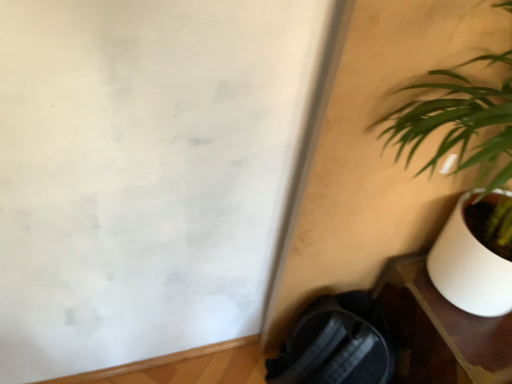
The image size is (512, 384). Describe the element at coordinates (457, 172) in the screenshot. I see `green leafy plant at right` at that location.

Locate an element on the screen. The image size is (512, 384). green leafy plant at right is located at coordinates (457, 172).

This screenshot has width=512, height=384. What do you see at coordinates (439, 330) in the screenshot?
I see `white glossy table at lower right` at bounding box center [439, 330].

Find the location of a particular element. The height and width of the screenshot is (384, 512). white glossy table at lower right is located at coordinates (439, 330).

What is the approximate width of white glossy table at lower right?

white glossy table at lower right is 15.37 inches wide.

I want to click on green leafy plant at right, so click(457, 172).

Does green leafy plant at right appear on the right side of white glossy table at lower right?

In fact, green leafy plant at right is to the left of white glossy table at lower right.

Considering the positions of objects green leafy plant at right and white glossy table at lower right in the image provided, who is behind, green leafy plant at right or white glossy table at lower right?

white glossy table at lower right is further away from the camera.

Is point (505, 181) in front of point (416, 373)?

Yes, it is.

From the image's perspective, is green leafy plant at right positioned above or below white glossy table at lower right?

green leafy plant at right is above white glossy table at lower right.

From a real-world perspective, which is physically above, green leafy plant at right or white glossy table at lower right?

green leafy plant at right.

Which of these two, green leafy plant at right or white glossy table at lower right, is thinner?

green leafy plant at right.

Who is shorter, green leafy plant at right or white glossy table at lower right?

white glossy table at lower right is shorter.

Is green leafy plant at right bigger or smaller than white glossy table at lower right?

In the image, green leafy plant at right appears to be smaller than white glossy table at lower right.

Is green leafy plant at right outside of white glossy table at lower right?

green leafy plant at right lies outside white glossy table at lower right's area.

Are green leafy plant at right and white glossy table at lower right far apart?

No, green leafy plant at right is not far from white glossy table at lower right.

Does green leafy plant at right turn towards white glossy table at lower right?

Yes, green leafy plant at right faces towards white glossy table at lower right.

The width and height of the screenshot is (512, 384). What are the coordinates of `houseplant that is above the white glossy table at lower right (from a real-world perspective)` in the screenshot? It's located at (457, 172).

Which is more to the right, white glossy table at lower right or green leafy plant at right?

From the viewer's perspective, white glossy table at lower right appears more on the right side.

Considering the relative positions of white glossy table at lower right and green leafy plant at right in the image provided, is white glossy table at lower right in front of green leafy plant at right?

No, it is behind green leafy plant at right.

Which point is more forward, (412, 285) or (484, 158)?

The point (484, 158) is more forward.

From the image's perspective, is white glossy table at lower right below green leafy plant at right?

Yes.

From a real-world perspective, does white glossy table at lower right stand above green leafy plant at right?

No, from a real-world perspective, white glossy table at lower right is not above green leafy plant at right.

Does white glossy table at lower right have a greater width compared to green leafy plant at right?

Yes.

Does white glossy table at lower right have a lesser height compared to green leafy plant at right?

Indeed, white glossy table at lower right has a lesser height compared to green leafy plant at right.

Who is bigger, white glossy table at lower right or green leafy plant at right?

Bigger between the two is white glossy table at lower right.

Is green leafy plant at right surrounded by white glossy table at lower right?

No.

Is white glossy table at lower right next to green leafy plant at right?

There is a gap between white glossy table at lower right and green leafy plant at right.

Is white glossy table at lower right facing away from green leafy plant at right?

Yes, white glossy table at lower right's orientation is away from green leafy plant at right.

How many degrees apart are the facing directions of white glossy table at lower right and green leafy plant at right?

The angular difference between white glossy table at lower right and green leafy plant at right is 1.37 degrees.

How far apart are white glossy table at lower right and green leafy plant at right?

white glossy table at lower right and green leafy plant at right are 7.97 inches apart.

Locate an element on the screen. This screenshot has width=512, height=384. table directly beneath the green leafy plant at right (from a real-world perspective) is located at coordinates (439, 330).

You are a GUI agent. You are given a task and a screenshot of the screen. Output one action in this format:
    pyautogui.click(x=<x>, y=<y>)
    Task: Click on the houseplant located in front of the white glossy table at lower right
    The width and height of the screenshot is (512, 384).
    Given the screenshot: What is the action you would take?
    pyautogui.click(x=457, y=172)

The width and height of the screenshot is (512, 384). Find the location of `houseplant that is on the left side of white glossy table at lower right`. houseplant that is on the left side of white glossy table at lower right is located at coordinates (457, 172).